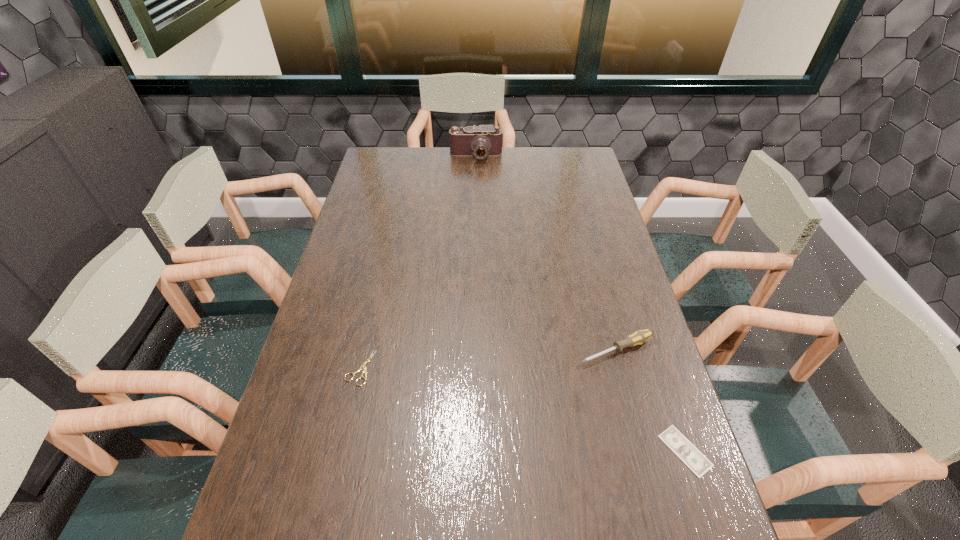
This screenshot has height=540, width=960. I want to click on free space located on the front-facing side of the second object from left to right, so click(475, 205).

Locate an element on the screen. This screenshot has height=540, width=960. free location located on the front-facing side of the second object from left to right is located at coordinates (475, 208).

You are a GUI agent. You are given a task and a screenshot of the screen. Output one action in this format:
    pyautogui.click(x=<x>, y=<y>)
    Task: Click on the vacant region located at the tip of the third shortest object
    This screenshot has height=540, width=960.
    Given the screenshot: What is the action you would take?
    pyautogui.click(x=461, y=408)

You are a GUI agent. You are given a task and a screenshot of the screen. Output one action in this format:
    pyautogui.click(x=<x>, y=<y>)
    Task: Click on the vacant space located at the tip of the third shortest object
    The image size is (960, 540).
    Given the screenshot: What is the action you would take?
    pyautogui.click(x=546, y=372)

Where is `free spot located at the tip of the third shortest object`? The height and width of the screenshot is (540, 960). free spot located at the tip of the third shortest object is located at coordinates (564, 364).

I want to click on object present at the far edge, so click(481, 141).

At what (x,y) coordinates should I click in order to perform the action: click on object that is at the left edge. Please return your answer as a coordinate pair (x, y). Looking at the image, I should click on (364, 370).

Image resolution: width=960 pixels, height=540 pixels. In order to click on money located in the right edge section of the desktop in this screenshot , I will do `click(677, 442)`.

I want to click on screwdriver at the right edge, so pos(639,337).

This screenshot has height=540, width=960. Identify the location of free space at the far edge of the desktop. (528, 156).